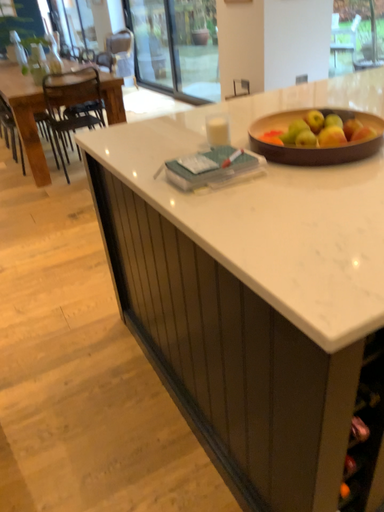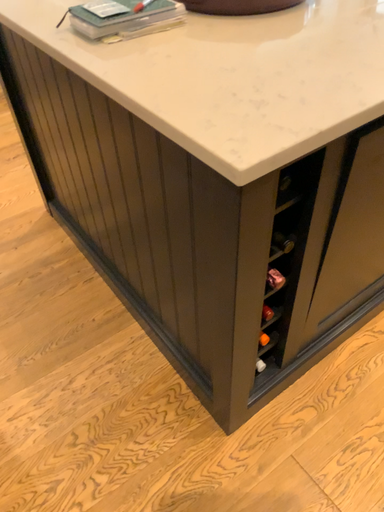
Question: How did the camera likely rotate when shooting the video?

Choices:
 (A) rotated left
 (B) rotated right

Answer: (B)